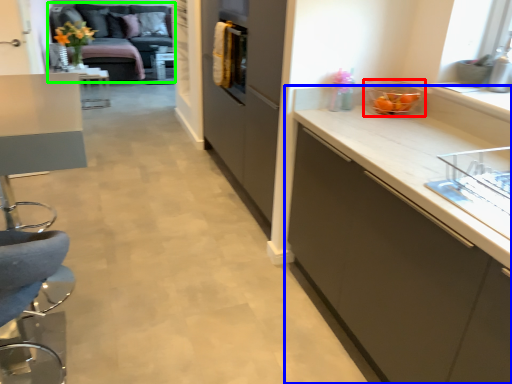
Question: Considering the real-world distances, which object is farthest from appliance (highlighted by a red box)? cabinetry (highlighted by a blue box) or studio couch (highlighted by a green box)?

Choices:
 (A) cabinetry
 (B) studio couch

Answer: (B)